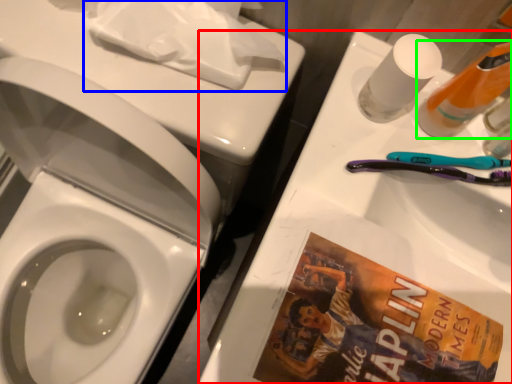
Question: Which is nearer to the porcelain (highlighted by a red box)? toilet paper (highlighted by a blue box) or cleaning product (highlighted by a green box).

Choices:
 (A) toilet paper
 (B) cleaning product

Answer: (B)